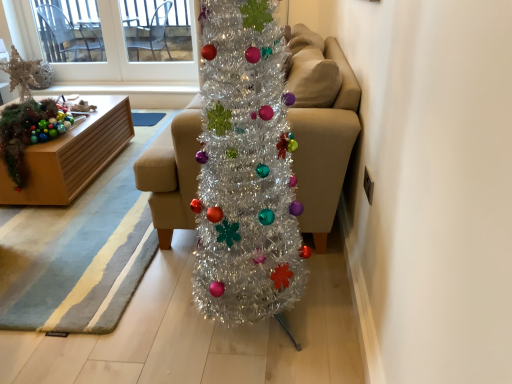
Question: Does shiny metallic garland at left lie behind beige fabric couch at center?

Choices:
 (A) no
 (B) yes

Answer: (B)

Question: Can you confirm if shiny metallic garland at left is bigger than beige fabric couch at center?

Choices:
 (A) no
 (B) yes

Answer: (A)

Question: Is shiny metallic garland at left smaller than beige fabric couch at center?

Choices:
 (A) yes
 (B) no

Answer: (A)

Question: Is the depth of shiny metallic garland at left less than that of beige fabric couch at center?

Choices:
 (A) no
 (B) yes

Answer: (A)

Question: From a real-world perspective, is shiny metallic garland at left physically above beige fabric couch at center?

Choices:
 (A) no
 (B) yes

Answer: (A)

Question: Can you confirm if shiny metallic garland at left is thinner than beige fabric couch at center?

Choices:
 (A) no
 (B) yes

Answer: (B)

Question: Does beige fabric couch at center come in front of shiny metallic garland at left?

Choices:
 (A) no
 (B) yes

Answer: (B)

Question: Considering the relative sizes of beige fabric couch at center and shiny metallic garland at left in the image provided, is beige fabric couch at center thinner than shiny metallic garland at left?

Choices:
 (A) no
 (B) yes

Answer: (A)

Question: Is beige fabric couch at center positioned behind shiny metallic garland at left?

Choices:
 (A) yes
 (B) no

Answer: (B)

Question: From the image's perspective, is beige fabric couch at center above shiny metallic garland at left?

Choices:
 (A) no
 (B) yes

Answer: (B)

Question: Is there a large distance between beige fabric couch at center and shiny metallic garland at left?

Choices:
 (A) no
 (B) yes

Answer: (B)

Question: Is the surface of beige fabric couch at center in direct contact with shiny metallic garland at left?

Choices:
 (A) yes
 (B) no

Answer: (B)

Question: From the image's perspective, is white plastic window screen at upper left below wooden box at left?

Choices:
 (A) yes
 (B) no

Answer: (B)